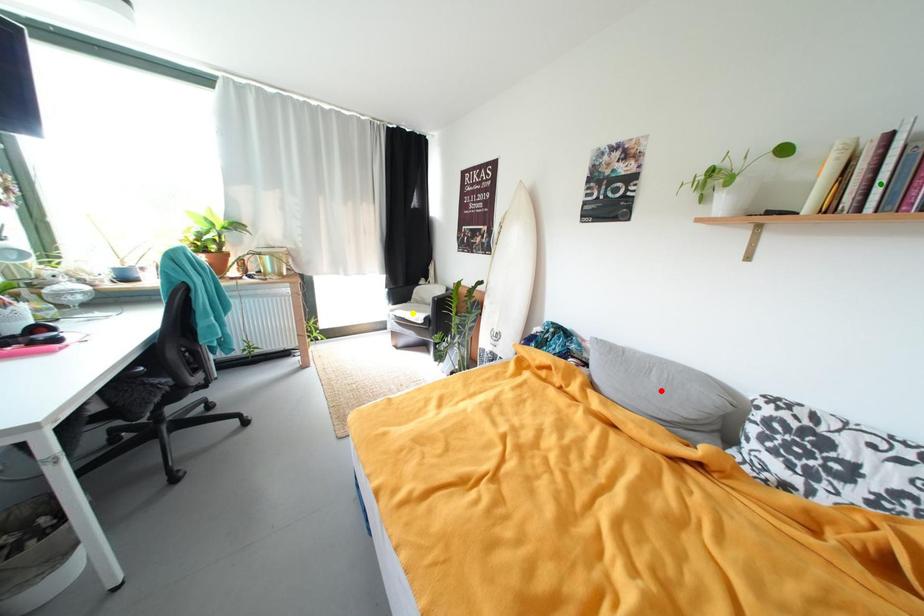
Order these from nearest to farthest:
yellow point
red point
green point

green point → red point → yellow point